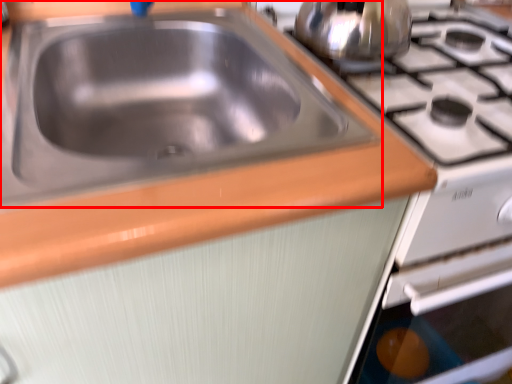
Question: Where is sink (annotated by the red box) located in relation to tea pot in the image?

Choices:
 (A) right
 (B) left

Answer: (B)